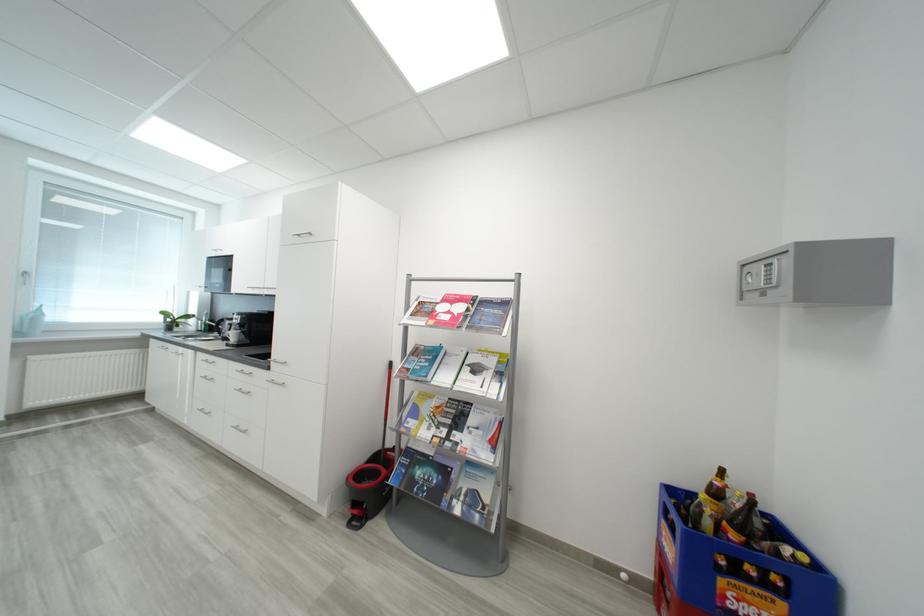
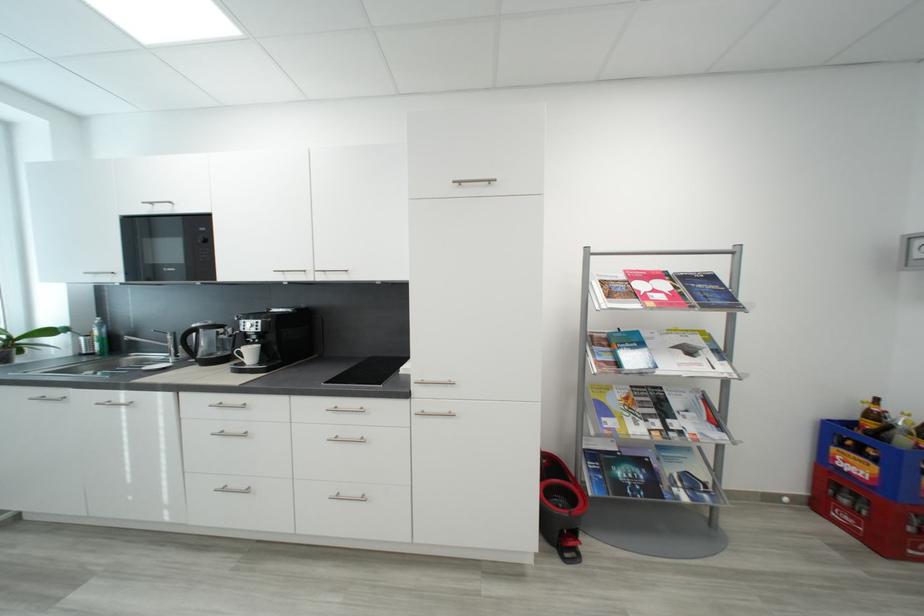
In the second image, find the point that corresponds to point (360, 525) in the first image.

(574, 557)